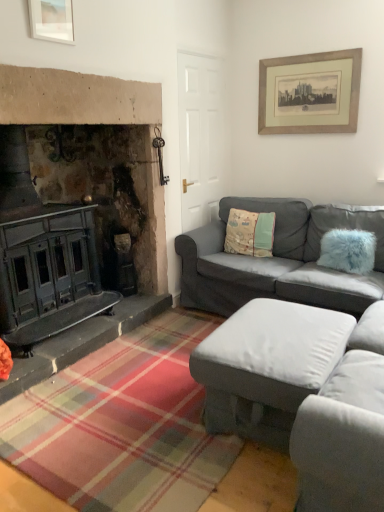
Question: From the image's perspective, is beige wooden picture frame at upper right, marked as the 2th picture frame in a front-to-back arrangement, below fuzzy blue pillow at right, the 1th pillow when ordered from front to back?

Choices:
 (A) no
 (B) yes

Answer: (A)

Question: Does beige wooden picture frame at upper right, the second picture frame in the left-to-right sequence, have a larger size compared to fuzzy blue pillow at right, the second pillow in the back-to-front sequence?

Choices:
 (A) no
 (B) yes

Answer: (A)

Question: Considering the relative sizes of beige wooden picture frame at upper right, the 1th picture frame in the right-to-left sequence, and fuzzy blue pillow at right, which is the 2th pillow in left-to-right order, in the image provided, is beige wooden picture frame at upper right, the 1th picture frame in the right-to-left sequence, taller than fuzzy blue pillow at right, which is the 2th pillow in left-to-right order,?

Choices:
 (A) yes
 (B) no

Answer: (A)

Question: Is beige wooden picture frame at upper right, marked as the 2th picture frame in a front-to-back arrangement, smaller than fuzzy blue pillow at right, positioned as the 1th pillow in right-to-left order?

Choices:
 (A) no
 (B) yes

Answer: (B)

Question: Can you confirm if beige wooden picture frame at upper right, acting as the 1th picture frame starting from the back, is positioned to the right of fuzzy blue pillow at right, the second pillow in the back-to-front sequence?

Choices:
 (A) yes
 (B) no

Answer: (B)

Question: Is beige wooden picture frame at upper right, marked as the 2th picture frame in a front-to-back arrangement, wider than fuzzy blue pillow at right, which is the 2th pillow in left-to-right order?

Choices:
 (A) no
 (B) yes

Answer: (A)

Question: Can you confirm if gray fabric couch at right, placed as the 1th studio couch when sorted from back to front, is positioned to the left of fuzzy blue pillow at right, the 1th pillow when ordered from front to back?

Choices:
 (A) yes
 (B) no

Answer: (A)

Question: Can you confirm if gray fabric couch at right, the second studio couch in the front-to-back sequence, is smaller than fuzzy blue pillow at right, the 1th pillow when ordered from front to back?

Choices:
 (A) yes
 (B) no

Answer: (B)

Question: Is fuzzy blue pillow at right, the second pillow in the back-to-front sequence, located within gray fabric couch at right, placed as the 1th studio couch when sorted from back to front?

Choices:
 (A) no
 (B) yes

Answer: (B)

Question: Are gray fabric couch at right, placed as the 1th studio couch when sorted from back to front, and fuzzy blue pillow at right, the 1th pillow when ordered from front to back, located far from each other?

Choices:
 (A) no
 (B) yes

Answer: (A)

Question: Considering the relative sizes of gray fabric couch at right, placed as the 1th studio couch when sorted from back to front, and fuzzy blue pillow at right, the 1th pillow when ordered from front to back, in the image provided, is gray fabric couch at right, placed as the 1th studio couch when sorted from back to front, thinner than fuzzy blue pillow at right, the 1th pillow when ordered from front to back,?

Choices:
 (A) yes
 (B) no

Answer: (B)

Question: Is the surface of gray fabric couch at right, the second studio couch in the front-to-back sequence, in direct contact with fuzzy blue pillow at right, the second pillow in the back-to-front sequence?

Choices:
 (A) yes
 (B) no

Answer: (B)

Question: Is beige wooden picture frame at upper right, marked as the 2th picture frame in a front-to-back arrangement, inside gray fabric couch at right, placed as the 1th studio couch when sorted from back to front?

Choices:
 (A) no
 (B) yes

Answer: (A)